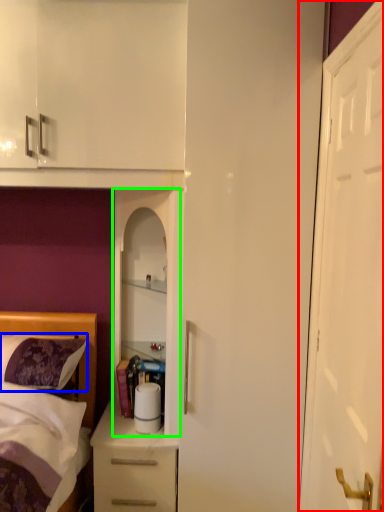
Question: Based on their relative distances, which object is nearer to door (highlighted by a red box)? Choose from pillow (highlighted by a blue box) and cabinetry (highlighted by a green box).

Choices:
 (A) pillow
 (B) cabinetry

Answer: (B)